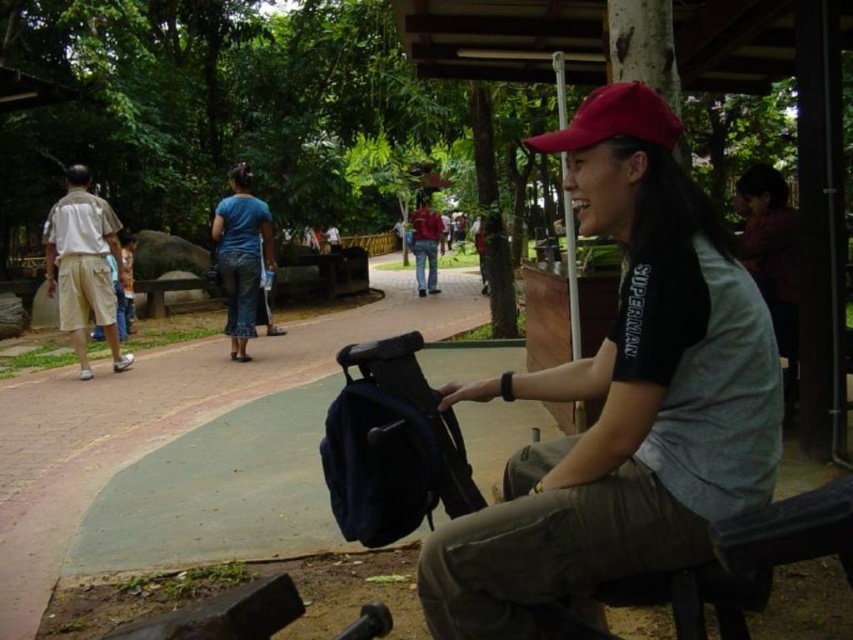
Is light beige cotton shorts at left positioned at the back of denim jeans at center?

That is False.

Who is higher up, light beige cotton shorts at left or denim jeans at center?

denim jeans at center

This screenshot has height=640, width=853. Describe the element at coordinates (83, 266) in the screenshot. I see `light beige cotton shorts at left` at that location.

The width and height of the screenshot is (853, 640). Find the location of `light beige cotton shorts at left`. light beige cotton shorts at left is located at coordinates point(83,266).

Is matte black backpack at center smaller than denim jeans at center?

Actually, matte black backpack at center might be larger than denim jeans at center.

Describe the element at coordinates (622, 397) in the screenshot. I see `matte black backpack at center` at that location.

Where is `matte black backpack at center`? The width and height of the screenshot is (853, 640). matte black backpack at center is located at coordinates (622, 397).

Between light beige cotton shorts at left and red matte cap at upper center, which one appears on the left side from the viewer's perspective?

Positioned to the left is light beige cotton shorts at left.

Who is more forward, (82, 289) or (604, 93)?

Point (604, 93)

Does point (83, 188) come behind point (538, 144)?

Yes, it is behind point (538, 144).

Identify the location of light beige cotton shorts at left. This screenshot has width=853, height=640. [x=83, y=266].